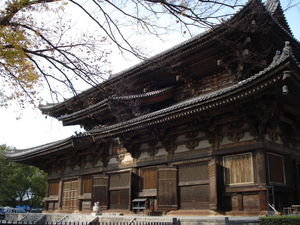
Identify the location of stairs. (71, 218).